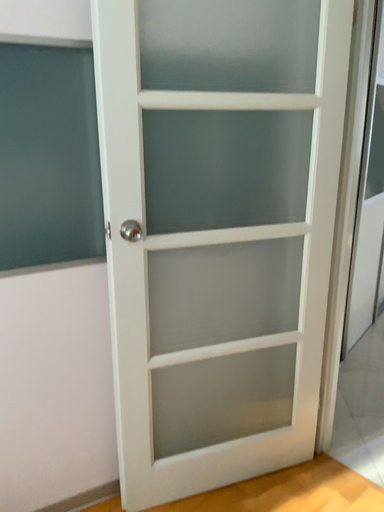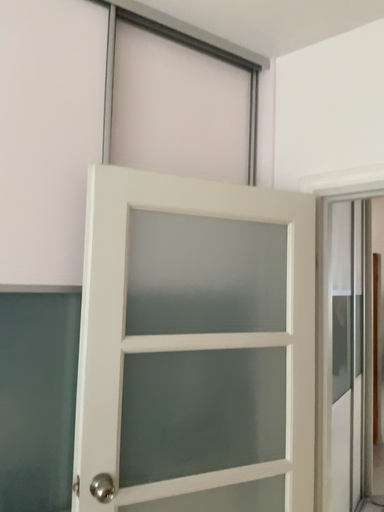
Question: Which way did the camera rotate in the video?

Choices:
 (A) rotated right
 (B) rotated left

Answer: (A)